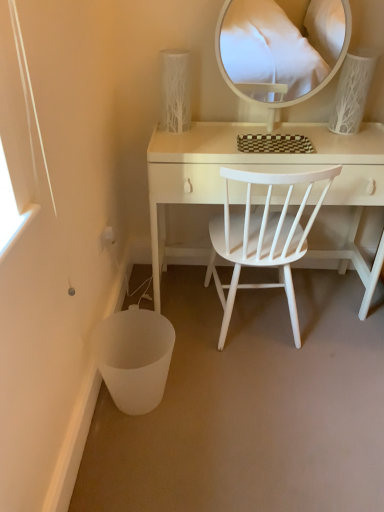
You are a GUI agent. You are given a task and a screenshot of the screen. Output one action in this format:
    pyautogui.click(x=<x>, y=<y>)
    Task: Click on the empty space that is in between white glossy mirror at upper center and white textured vase at upper center, which ranks as the 1th table lamp in left-to-right order
    This screenshot has width=384, height=512.
    Given the screenshot: What is the action you would take?
    [x=226, y=128]